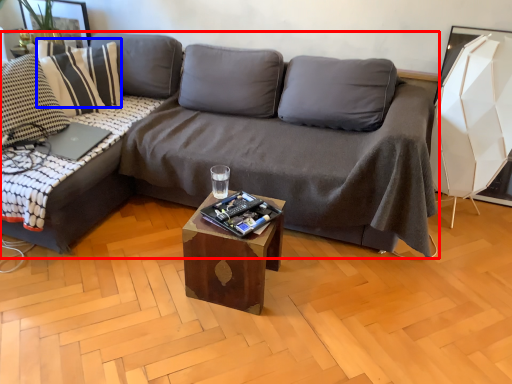
Question: Which point is closer to the camera, studio couch (highlighted by a red box) or pillow (highlighted by a blue box)?

Choices:
 (A) studio couch
 (B) pillow

Answer: (A)